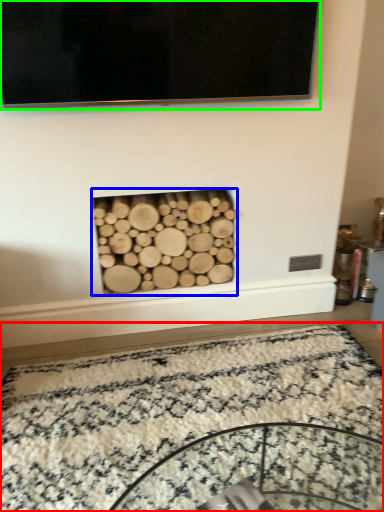
Question: Which object is the closest to the mat (highlighted by a red box)? Choose among these: fireplace (highlighted by a blue box) or television (highlighted by a green box).

Choices:
 (A) fireplace
 (B) television

Answer: (A)